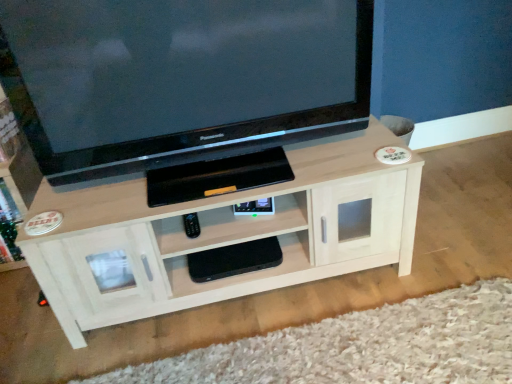
What do you see at coordinates (243, 274) in the screenshot?
I see `black matte gaming console at center, the second shelf viewed from the top` at bounding box center [243, 274].

Describe the element at coordinates (14, 183) in the screenshot. I see `white wood tv cabinet at lower left` at that location.

Locate an element on the screen. The height and width of the screenshot is (384, 512). light wood shelf at center, marked as the second shelf in a bottom-to-top arrangement is located at coordinates (223, 233).

Identify the location of black matte gaming console at center, the second shelf viewed from the top. (243, 274).

Is black matte gaming console at center, the second shelf viewed from the top, completely or partially inside white wood tv cabinet at lower left?

No, black matte gaming console at center, the second shelf viewed from the top, is not inside white wood tv cabinet at lower left.

Does white wood tv cabinet at lower left have a greater width compared to black matte gaming console at center, the 1th shelf positioned from the bottom?

Yes.

You are a GUI agent. You are given a task and a screenshot of the screen. Output one action in this format:
    pyautogui.click(x=<x>, y=<y>)
    Task: Click on the tv cabinet above the black matte gaming console at center, the second shelf viewed from the top (from the image's perspective)
    
    Given the screenshot: What is the action you would take?
    pyautogui.click(x=14, y=183)

Looking at the image, does white wood tv cabinet at lower left seem bigger or smaller compared to black matte gaming console at center, the 1th shelf positioned from the bottom?

white wood tv cabinet at lower left is bigger than black matte gaming console at center, the 1th shelf positioned from the bottom.

From a real-world perspective, which is physically below, white wood tv cabinet at lower left or black glossy television at upper center?

In real-world perspective, white wood tv cabinet at lower left is lower.

Which is more to the left, white wood tv cabinet at lower left or black glossy television at upper center?

white wood tv cabinet at lower left.

From the image's perspective, is white wood tv cabinet at lower left located above or below black glossy television at upper center?

Based on their image positions, white wood tv cabinet at lower left is located beneath black glossy television at upper center.

Is black glossy television at upper center a part of white wood tv cabinet at lower left?

No, black glossy television at upper center is located outside of white wood tv cabinet at lower left.

From the image's perspective, which one is positioned higher, light wood shelf at center, marked as the second shelf in a bottom-to-top arrangement, or black matte gaming console at center, the second shelf viewed from the top?

light wood shelf at center, marked as the second shelf in a bottom-to-top arrangement.

Is point (360, 210) closer or farther from the camera than point (177, 268)?

Clearly, point (360, 210) is closer to the camera than point (177, 268).

Considering the positions of objects light wood shelf at center, which appears as the 1th shelf when viewed from the top, and black matte gaming console at center, the 1th shelf positioned from the bottom, in the image provided, who is behind, light wood shelf at center, which appears as the 1th shelf when viewed from the top, or black matte gaming console at center, the 1th shelf positioned from the bottom,?

Positioned behind is black matte gaming console at center, the 1th shelf positioned from the bottom.

Does black glossy television at upper center have a greater height compared to black matte gaming console at center, the second shelf viewed from the top?

Indeed, black glossy television at upper center has a greater height compared to black matte gaming console at center, the second shelf viewed from the top.

Based on the photo, can you see black glossy television at upper center touching black matte gaming console at center, the 1th shelf positioned from the bottom?

No, black glossy television at upper center is not with black matte gaming console at center, the 1th shelf positioned from the bottom.

Where is `the 2nd shelf located beneath the black glossy television at upper center (from a real-world perspective)`? The height and width of the screenshot is (384, 512). the 2nd shelf located beneath the black glossy television at upper center (from a real-world perspective) is located at coordinates (243, 274).

Considering the sizes of objects black glossy television at upper center and black matte gaming console at center, the second shelf viewed from the top, in the image provided, who is wider, black glossy television at upper center or black matte gaming console at center, the second shelf viewed from the top,?

black glossy television at upper center is wider.

Is black matte gaming console at center, the second shelf viewed from the top, wider or thinner than light wood shelf at center, marked as the second shelf in a bottom-to-top arrangement?

black matte gaming console at center, the second shelf viewed from the top, is thinner than light wood shelf at center, marked as the second shelf in a bottom-to-top arrangement.

Would you consider black matte gaming console at center, the 1th shelf positioned from the bottom, to be distant from light wood shelf at center, marked as the second shelf in a bottom-to-top arrangement?

black matte gaming console at center, the 1th shelf positioned from the bottom, is actually quite close to light wood shelf at center, marked as the second shelf in a bottom-to-top arrangement.

From a real-world perspective, which is physically above, black matte gaming console at center, the 1th shelf positioned from the bottom, or light wood shelf at center, marked as the second shelf in a bottom-to-top arrangement?

light wood shelf at center, marked as the second shelf in a bottom-to-top arrangement, is physically above.

Is light wood shelf at center, which appears as the 1th shelf when viewed from the top, inside black matte gaming console at center, the 1th shelf positioned from the bottom?

No, light wood shelf at center, which appears as the 1th shelf when viewed from the top, is not inside black matte gaming console at center, the 1th shelf positioned from the bottom.

From the image's perspective, relative to black glossy television at upper center, is black matte gaming console at center, the second shelf viewed from the top, above or below?

black matte gaming console at center, the second shelf viewed from the top, is situated lower than black glossy television at upper center in the image.

Considering the relative sizes of black matte gaming console at center, the 1th shelf positioned from the bottom, and black glossy television at upper center in the image provided, is black matte gaming console at center, the 1th shelf positioned from the bottom, bigger than black glossy television at upper center?

Actually, black matte gaming console at center, the 1th shelf positioned from the bottom, might be smaller than black glossy television at upper center.

Identify the location of shelf that is the 2nd one below the black glossy television at upper center (from a real-world perspective). Image resolution: width=512 pixels, height=384 pixels. coord(243,274).

Is black glossy television at upper center taller or shorter than light wood shelf at center, marked as the second shelf in a bottom-to-top arrangement?

Clearly, black glossy television at upper center is taller compared to light wood shelf at center, marked as the second shelf in a bottom-to-top arrangement.

Consider the image. Considering the sizes of black glossy television at upper center and light wood shelf at center, marked as the second shelf in a bottom-to-top arrangement, in the image, is black glossy television at upper center wider or thinner than light wood shelf at center, marked as the second shelf in a bottom-to-top arrangement,?

Considering their sizes, black glossy television at upper center looks slimmer than light wood shelf at center, marked as the second shelf in a bottom-to-top arrangement.

Is black glossy television at upper center not near light wood shelf at center, marked as the second shelf in a bottom-to-top arrangement?

No, black glossy television at upper center is not far from light wood shelf at center, marked as the second shelf in a bottom-to-top arrangement.

Is black glossy television at upper center to the left or to the right of light wood shelf at center, marked as the second shelf in a bottom-to-top arrangement, in the image?

black glossy television at upper center is positioned on light wood shelf at center, marked as the second shelf in a bottom-to-top arrangement,'s left side.

You are a GUI agent. You are given a task and a screenshot of the screen. Output one action in this format:
    pyautogui.click(x=<x>, y=<y>)
    Task: Click on the 2nd shelf directly beneath the white wood tv cabinet at lower left (from a real-world perspective)
    The height and width of the screenshot is (384, 512).
    Given the screenshot: What is the action you would take?
    pyautogui.click(x=243, y=274)

I want to click on television on the right of white wood tv cabinet at lower left, so click(x=180, y=78).

From the picture: Considering their positions, is black matte gaming console at center, the 1th shelf positioned from the bottom, positioned further to black glossy television at upper center than light wood shelf at center, marked as the second shelf in a bottom-to-top arrangement?

The object further to black glossy television at upper center is black matte gaming console at center, the 1th shelf positioned from the bottom.

From the picture: Estimate the real-world distances between objects in this image. Which object is closer to white wood tv cabinet at lower left, black glossy television at upper center or light wood shelf at center, which appears as the 1th shelf when viewed from the top?

black glossy television at upper center is closer to white wood tv cabinet at lower left.

Looking at the image, which one is located further to light wood shelf at center, marked as the second shelf in a bottom-to-top arrangement, black glossy television at upper center or black matte gaming console at center, the second shelf viewed from the top?

The object further to light wood shelf at center, marked as the second shelf in a bottom-to-top arrangement, is black glossy television at upper center.

Considering their positions, is light wood shelf at center, which appears as the 1th shelf when viewed from the top, positioned closer to black matte gaming console at center, the second shelf viewed from the top, than black glossy television at upper center?

light wood shelf at center, which appears as the 1th shelf when viewed from the top.

Estimate the real-world distances between objects in this image. Which object is further from black glossy television at upper center, white wood tv cabinet at lower left or black matte gaming console at center, the 1th shelf positioned from the bottom?

white wood tv cabinet at lower left is positioned further to the anchor black glossy television at upper center.

From the image, which object appears to be nearer to light wood shelf at center, which appears as the 1th shelf when viewed from the top, white wood tv cabinet at lower left or black matte gaming console at center, the second shelf viewed from the top?

black matte gaming console at center, the second shelf viewed from the top, is closer to light wood shelf at center, which appears as the 1th shelf when viewed from the top.

Estimate the real-world distances between objects in this image. Which object is further from black glossy television at upper center, black matte gaming console at center, the 1th shelf positioned from the bottom, or white wood tv cabinet at lower left?

white wood tv cabinet at lower left is positioned further to the anchor black glossy television at upper center.

Based on their spatial positions, is white wood tv cabinet at lower left or black glossy television at upper center further from light wood shelf at center, which appears as the 1th shelf when viewed from the top?

The object further to light wood shelf at center, which appears as the 1th shelf when viewed from the top, is white wood tv cabinet at lower left.

Find the location of a particular element. The width and height of the screenshot is (512, 384). television located between white wood tv cabinet at lower left and black matte gaming console at center, the second shelf viewed from the top, in the left-right direction is located at coordinates (180, 78).

Find the location of a particular element. shelf between white wood tv cabinet at lower left and black matte gaming console at center, the second shelf viewed from the top, from left to right is located at coordinates (223, 233).

You are a GUI agent. You are given a task and a screenshot of the screen. Output one action in this format:
    pyautogui.click(x=<x>, y=<y>)
    Task: Click on the shelf that lies between black glossy television at upper center and black matte gaming console at center, the second shelf viewed from the top, from top to bottom
    This screenshot has height=384, width=512.
    Given the screenshot: What is the action you would take?
    pyautogui.click(x=223, y=233)

What are the coordinates of `television situated between white wood tv cabinet at lower left and light wood shelf at center, marked as the second shelf in a bottom-to-top arrangement, from left to right` in the screenshot? It's located at (180, 78).